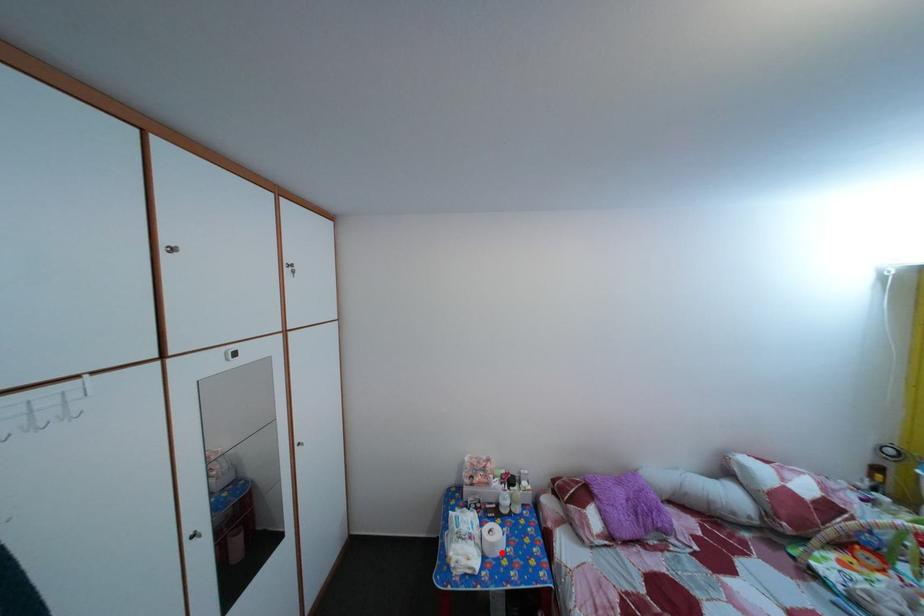
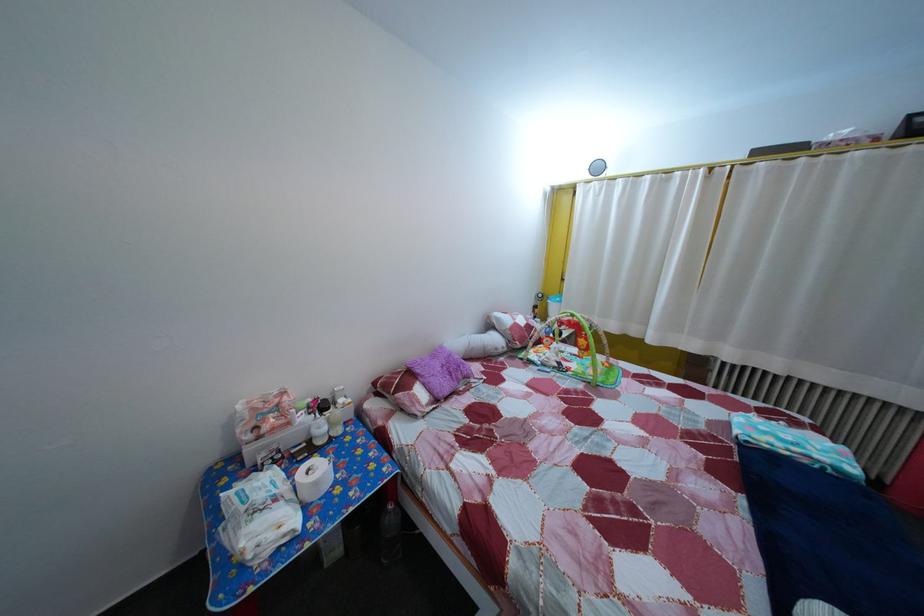
In the second image, find the point that corresponds to the highlighted location in the first image.

(325, 491)